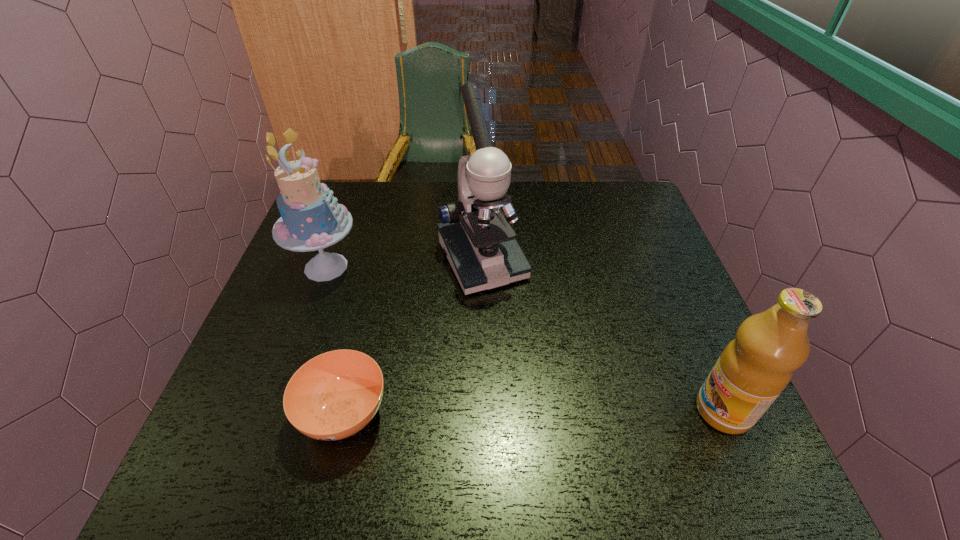
Locate an element on the screen. This screenshot has width=960, height=540. vacant space on the desktop that is between the soup bowl and the third tallest object and is positioned at the eyepiece of the second object from right to left is located at coordinates (567, 412).

The image size is (960, 540). What are the coordinates of `vacant spot on the desktop that is between the soup bowl and the rightmost object and is positioned with a ladder on the side of the cake` in the screenshot? It's located at (561, 412).